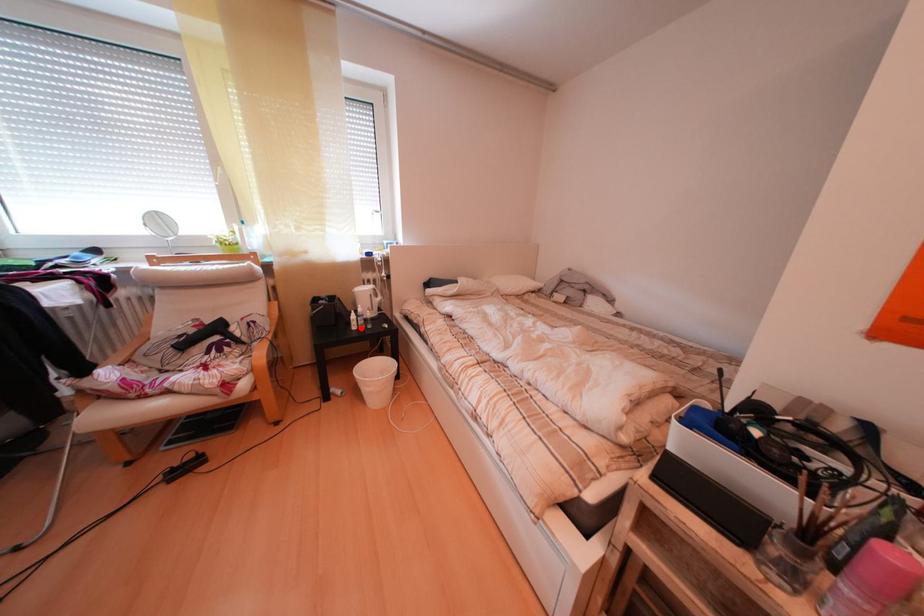
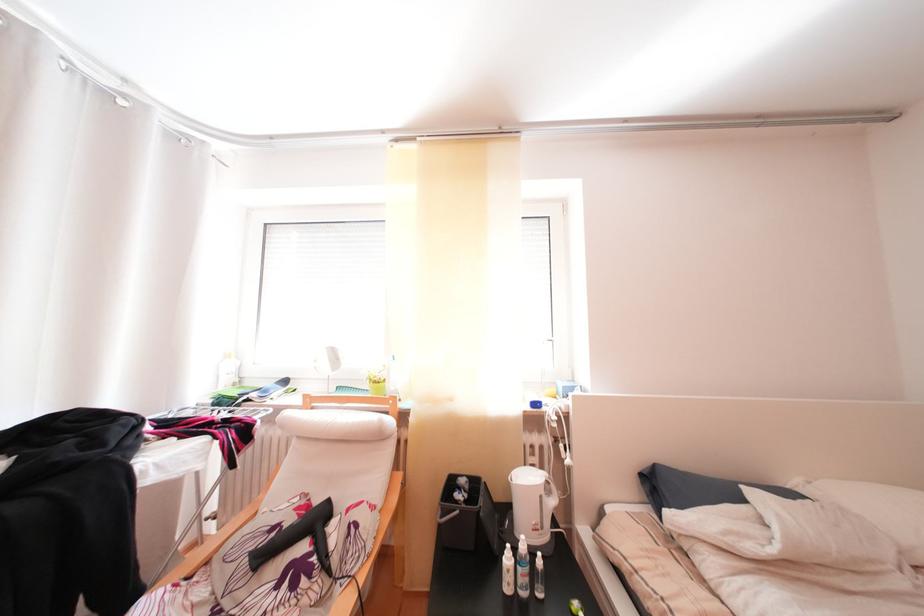
Question: I am providing you with two images of the same scene from different viewpoints. Given a red point in image1, look at the same physical point in image2. Is it:

Choices:
 (A) Closer to the viewpoint
 (B) Farther from the viewpoint

Answer: (B)